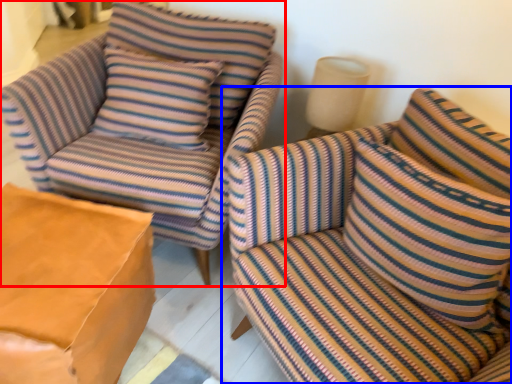
Question: Among these objects, which one is nearest to the camera, chair (highlighted by a red box) or studio couch (highlighted by a blue box)?

Choices:
 (A) chair
 (B) studio couch

Answer: (B)